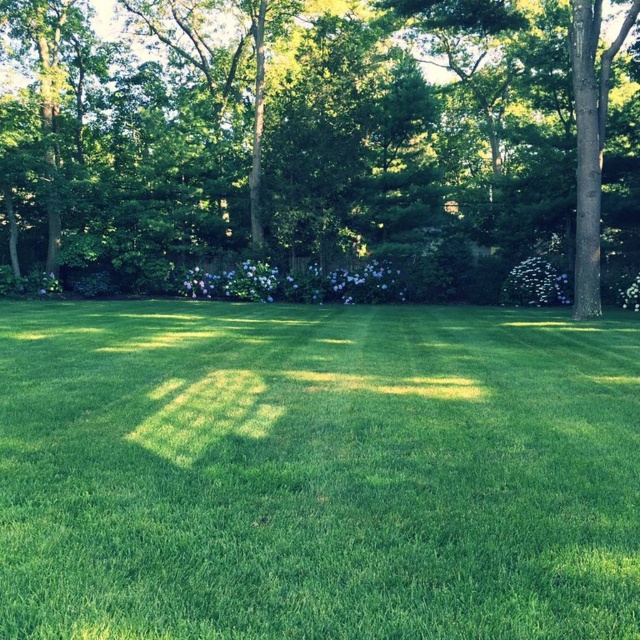
Question: Which of the following is the closest to the observer?

Choices:
 (A) (339, 208)
 (B) (413, 602)

Answer: (B)

Question: Does green grass at center have a larger size compared to green leafy tree at center?

Choices:
 (A) no
 (B) yes

Answer: (A)

Question: Does green grass at center appear under green leafy tree at center?

Choices:
 (A) yes
 (B) no

Answer: (A)

Question: Which point appears farthest from the camera in this image?

Choices:
 (A) (307, 72)
 (B) (172, 525)

Answer: (A)

Question: From the image, what is the correct spatial relationship of green grass at center in relation to green leafy tree at center?

Choices:
 (A) right
 (B) left

Answer: (A)